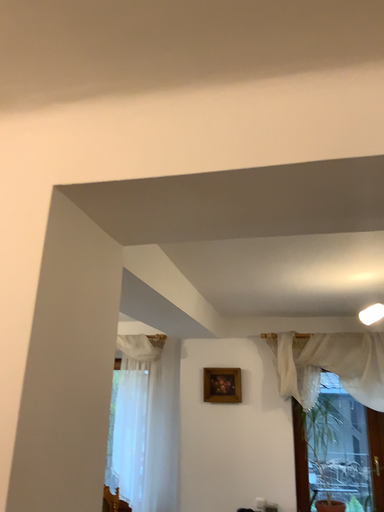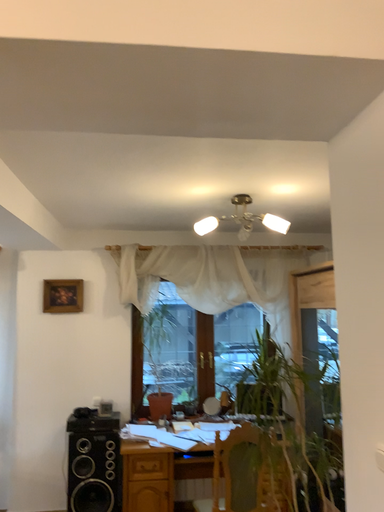
Question: How did the camera likely rotate when shooting the video?

Choices:
 (A) rotated downward
 (B) rotated upward

Answer: (A)